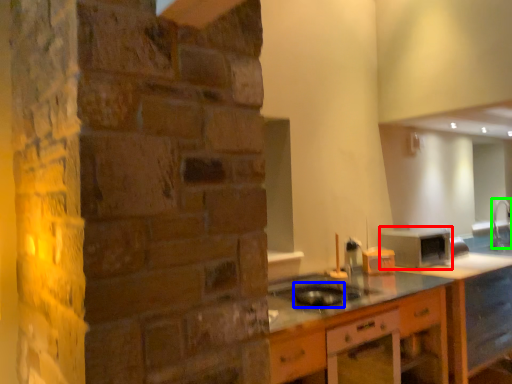
Question: Estimate the real-world distances between objects in this image. Which object is closer to appliance (highlighted by a red box), appliance (highlighted by a blue box) or faucet (highlighted by a green box)?

Choices:
 (A) appliance
 (B) faucet

Answer: (A)